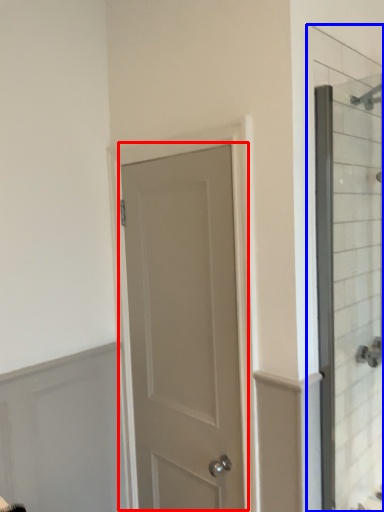
Question: Which point is further to the camera, door (highlighted by a red box) or glass door (highlighted by a blue box)?

Choices:
 (A) door
 (B) glass door

Answer: (A)